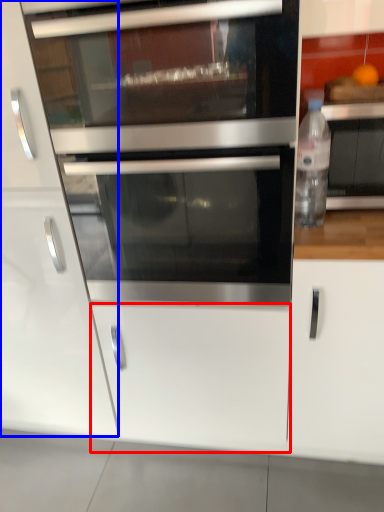
Question: Which object is closer to the camera taking this photo, drawer (highlighted by a red box) or cabinetry (highlighted by a blue box)?

Choices:
 (A) drawer
 (B) cabinetry

Answer: (B)